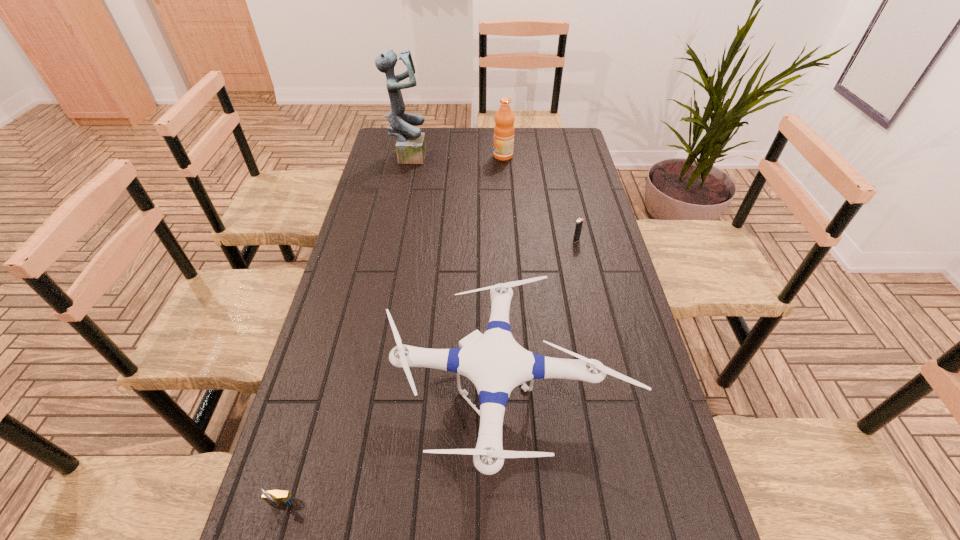
Find the location of a particular element. free space located on the front of the igniter is located at coordinates (589, 300).

Where is `sculpture positioned at the far edge`? sculpture positioned at the far edge is located at coordinates (411, 146).

Identify the location of fruit juice situated at the far edge. (504, 119).

Where is `sculpture positioned at the left edge`? sculpture positioned at the left edge is located at coordinates (411, 146).

At what (x,y) coordinates should I click in order to perform the action: click on padlock present at the left edge. Please return your answer as a coordinate pair (x, y). Looking at the image, I should click on (277, 498).

Where is `drone present at the right edge`? The width and height of the screenshot is (960, 540). drone present at the right edge is located at coordinates click(496, 364).

The height and width of the screenshot is (540, 960). I want to click on igniter that is at the right edge, so click(x=579, y=223).

The height and width of the screenshot is (540, 960). I want to click on object that is positioned at the far left corner, so (x=411, y=146).

You are a GUI agent. You are given a task and a screenshot of the screen. Output one action in this format:
    pyautogui.click(x=<x>, y=<y>)
    Task: Click on the vacant space at the left edge of the desktop
    Image resolution: width=960 pixels, height=540 pixels.
    Given the screenshot: What is the action you would take?
    pyautogui.click(x=333, y=397)

This screenshot has height=540, width=960. In the image, there is a desktop. In order to click on free space at the right edge in this screenshot , I will do `click(576, 161)`.